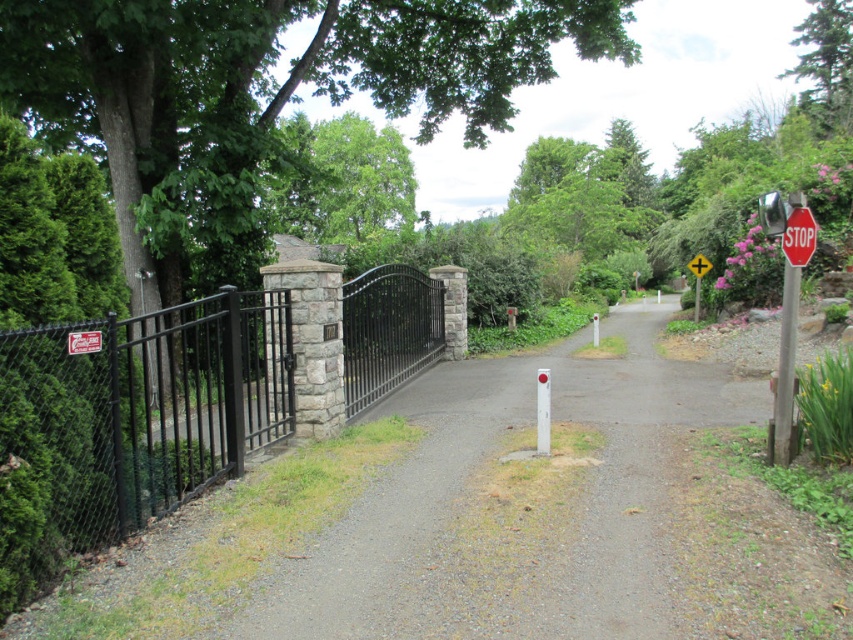
You are driving a truck that is 3 meters tall. You need to pass under the green leafy tree at upper right and the red metal sign at right. Which object will you hit first if you continue driving straight?

The red metal sign at right will be hit first because it is shorter than the green leafy tree at upper right, so the truck will hit the lower obstacle first.

You are driving a car and approaching the gray gravel driveway at center. There is a red plastic stop sign at upper right. Which object is located higher up in the image?

The red plastic stop sign at upper right is located higher up in the image than the gray gravel driveway at center.